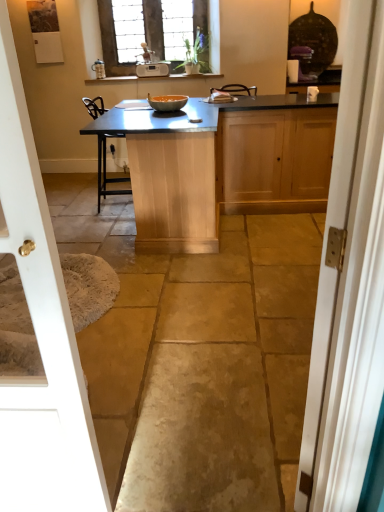
Locate an element on the screen. Image resolution: width=384 pixels, height=512 pixels. free space that is in between white painted wood door at right, arranged as the 1th door when viewed from the right, and light wood cabinet at center, positioned as the 1th cabinetry in left-to-right order is located at coordinates (219, 305).